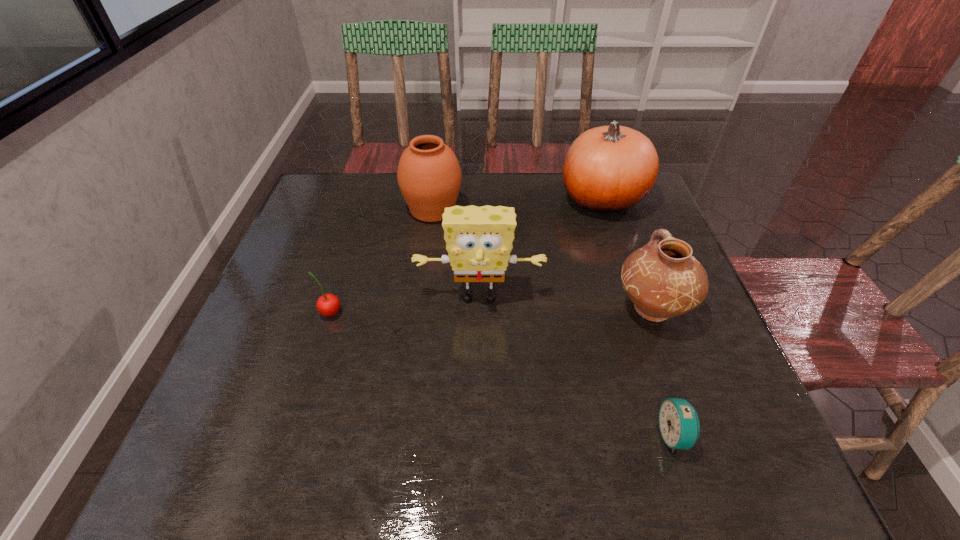
The image size is (960, 540). Find the location of `pumpkin`. pumpkin is located at coordinates (607, 169).

At what (x,y) coordinates should I click in order to perform the action: click on sponge. Please return your answer as a coordinate pair (x, y). This screenshot has height=540, width=960. Looking at the image, I should click on (479, 240).

Where is `urn`? Image resolution: width=960 pixels, height=540 pixels. urn is located at coordinates (429, 176).

Where is `pottery`? The height and width of the screenshot is (540, 960). pottery is located at coordinates coord(662,279).

Locate an element on the screen. The image size is (960, 540). cherry is located at coordinates (328, 304).

I want to click on the nearest object, so click(679, 424).

At what (x,y) coordinates should I click in order to perform the action: click on the shortest object. Please return your answer as a coordinate pair (x, y). This screenshot has width=960, height=540. Looking at the image, I should click on (679, 424).

Identify the location of blank space located 0.280m on the left of the pumpkin. This screenshot has width=960, height=540. (465, 198).

This screenshot has width=960, height=540. In order to click on free space located on the face of the sponge in this screenshot , I will do `click(479, 476)`.

The image size is (960, 540). I want to click on vacant area located 0.050m on the back of the urn, so click(436, 183).